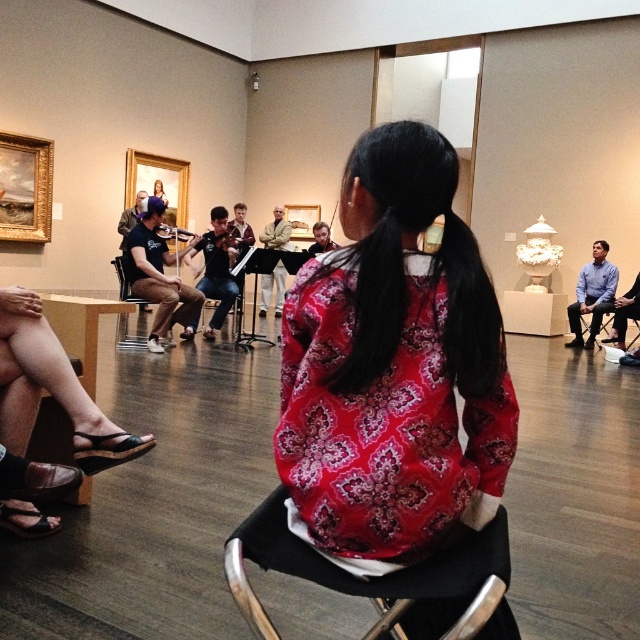
Between black fabric chair at center and metallic silver chair at center, which one is positioned lower?

black fabric chair at center

Which of these two, black fabric chair at center or metallic silver chair at center, stands taller?

Standing taller between the two is metallic silver chair at center.

Locate an element on the screen. black fabric chair at center is located at coordinates (381, 579).

Where is `black fabric chair at center`? The width and height of the screenshot is (640, 640). black fabric chair at center is located at coordinates (381, 579).

From the picture: Between patterned fabric shirt at center and blue shirt at right, which one appears on the right side from the viewer's perspective?

blue shirt at right

Is patterned fabric shirt at center wider than blue shirt at right?

In fact, patterned fabric shirt at center might be narrower than blue shirt at right.

Which is behind, point (304, 486) or point (595, 268)?

Positioned behind is point (595, 268).

Find the location of `patterned fabric shirt at center`. patterned fabric shirt at center is located at coordinates (394, 368).

Is patterned fabric shirt at center to the left of black fabric chair at center from the viewer's perspective?

Incorrect, patterned fabric shirt at center is not on the left side of black fabric chair at center.

Is point (291, 380) closer to viewer compared to point (436, 557)?

That is False.

The height and width of the screenshot is (640, 640). I want to click on patterned fabric shirt at center, so click(x=394, y=368).